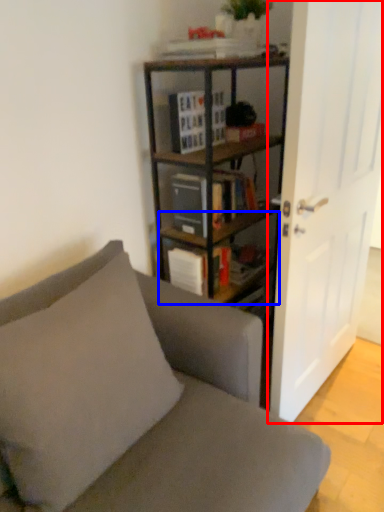
Question: Which point is further to the camera, door (highlighted by a red box) or shelf (highlighted by a blue box)?

Choices:
 (A) door
 (B) shelf

Answer: (B)